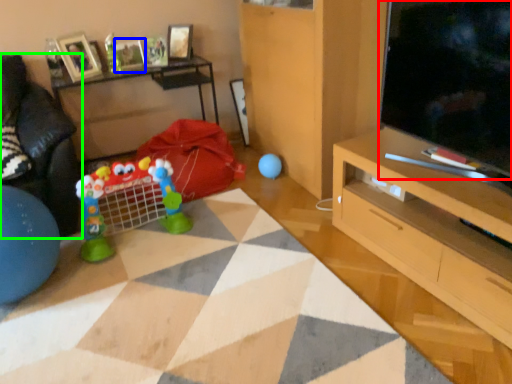
Question: Which object is positioned farthest from television (highlighted by a red box)? Select from picture frame (highlighted by a blue box) and studio couch (highlighted by a green box).

Choices:
 (A) picture frame
 (B) studio couch

Answer: (A)